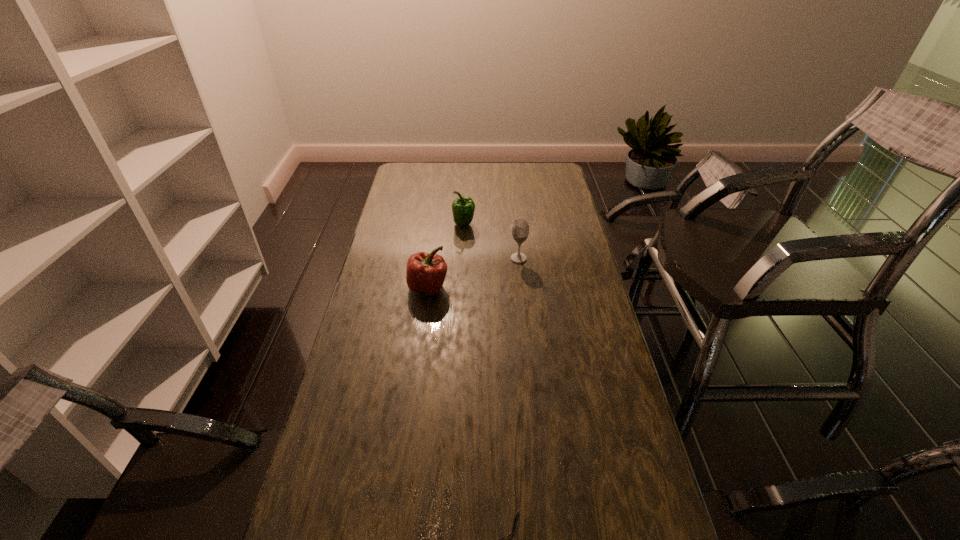
The width and height of the screenshot is (960, 540). What are the coordinates of `wineglass` in the screenshot? It's located at (520, 230).

I want to click on the third nearest object, so click(520, 230).

Find the location of a particular element. The height and width of the screenshot is (540, 960). the farthest object is located at coordinates (463, 208).

Identify the location of the second nearest object. (426, 272).

What are the coordinates of `vacant space located on the front of the rightmost object` in the screenshot? It's located at (525, 325).

Where is `free region located on the right of the farthest object`? The image size is (960, 540). free region located on the right of the farthest object is located at coordinates (494, 224).

Identify the location of free space located 0.280m on the front of the nearer bell pepper. This screenshot has height=540, width=960. (418, 368).

I want to click on object that is at the left edge, so click(426, 272).

At what (x,y) coordinates should I click in order to perform the action: click on blank space at the far edge of the desktop. Please return your answer as a coordinate pair (x, y). The width and height of the screenshot is (960, 540). Looking at the image, I should click on (454, 162).

The height and width of the screenshot is (540, 960). In order to click on free space at the left edge of the desktop in this screenshot , I will do `click(396, 281)`.